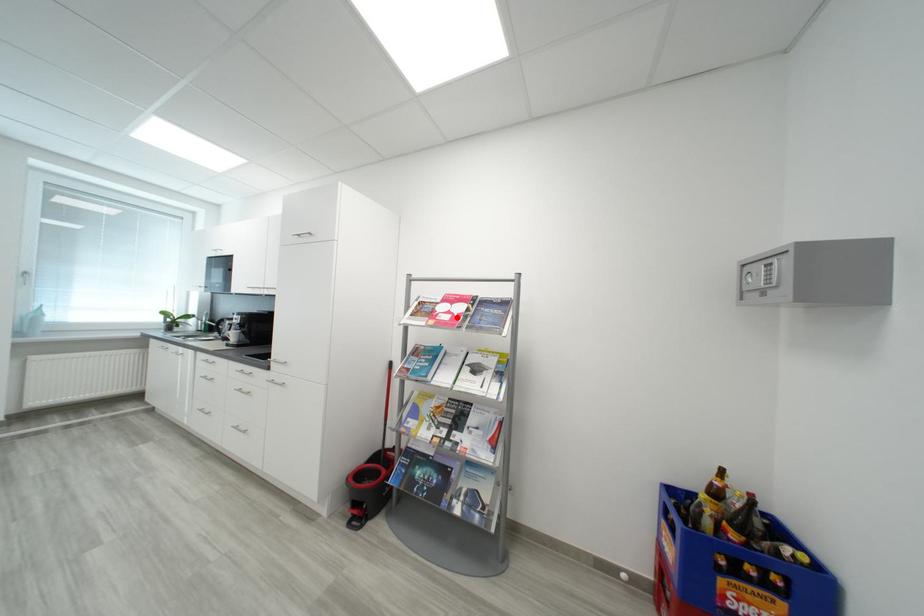
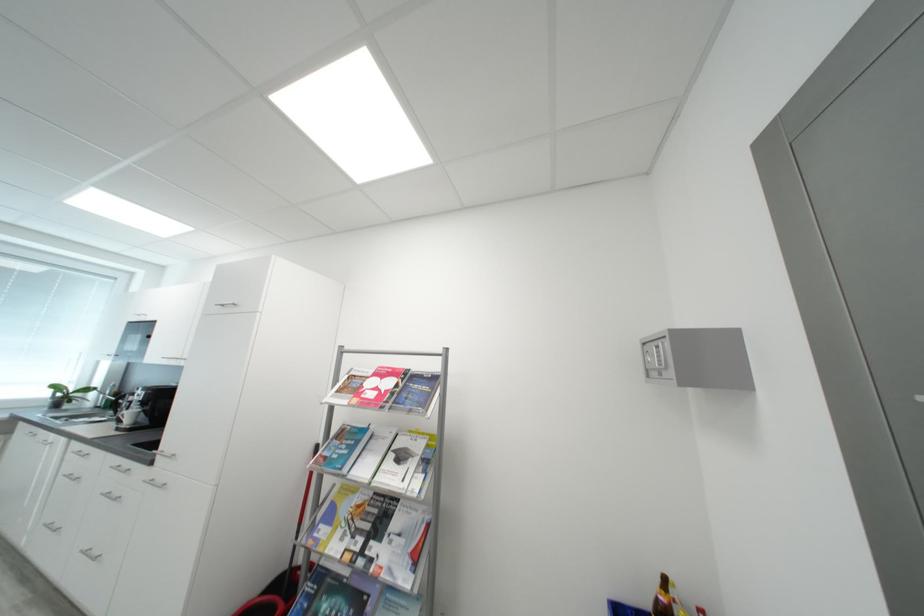
Locate, in the second image, the point that corresponds to the highlighted location in the first image.

(383, 395)